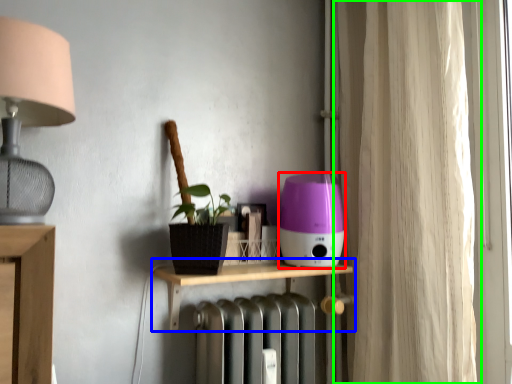
Question: Based on their relative distances, which object is farther from appliance (highlighted by a red box)? Choose from shelf (highlighted by a blue box) and curtain (highlighted by a green box).

Choices:
 (A) shelf
 (B) curtain

Answer: (B)